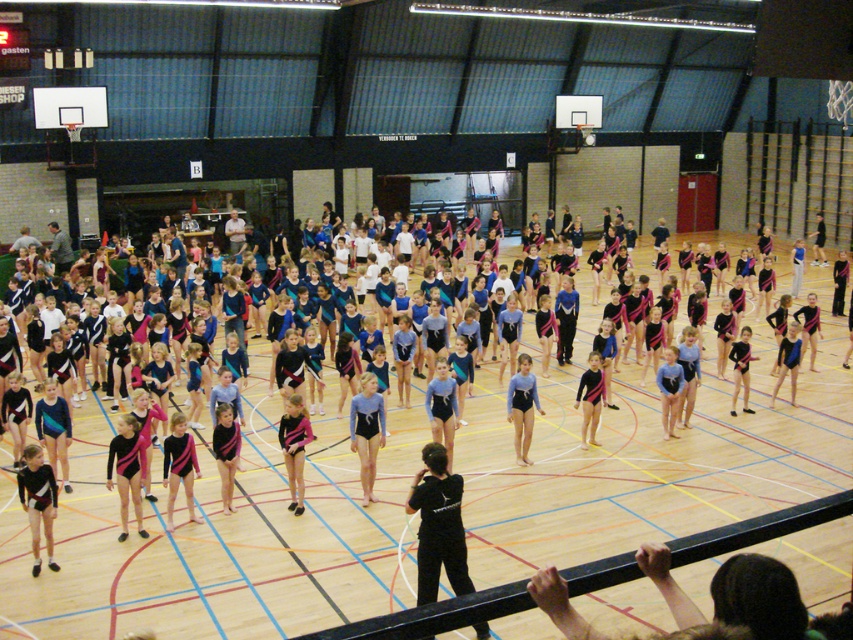
Does point (364, 406) come behind point (509, 392)?

No, it is not.

What do you see at coordinates (367, 432) in the screenshot? The height and width of the screenshot is (640, 853). I see `blue leotard at center` at bounding box center [367, 432].

Where is `blue leotard at center`? blue leotard at center is located at coordinates (367, 432).

Can you confirm if black matte/black uniform at center is wider than blue leotard at center?

Yes, black matte/black uniform at center is wider than blue leotard at center.

I want to click on black matte/black uniform at center, so click(x=438, y=525).

The image size is (853, 640). Find the location of `black matte/black uniform at center`. black matte/black uniform at center is located at coordinates (438, 525).

Is black matte/black uniform at center further to camera compared to blue matte leotard at center?

No.

Between black matte/black uniform at center and blue matte leotard at center, which one appears on the right side from the viewer's perspective?

blue matte leotard at center

Locate an element on the screen. black matte/black uniform at center is located at coordinates (438, 525).